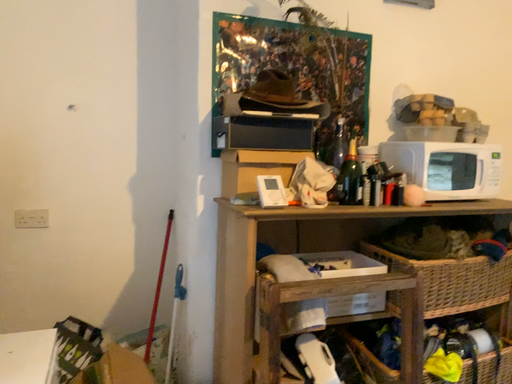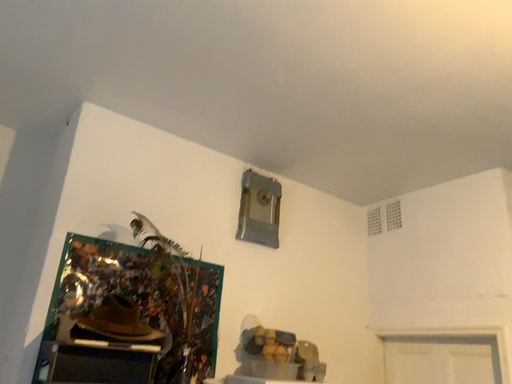
Question: How did the camera likely rotate when shooting the video?

Choices:
 (A) rotated left
 (B) rotated right

Answer: (B)